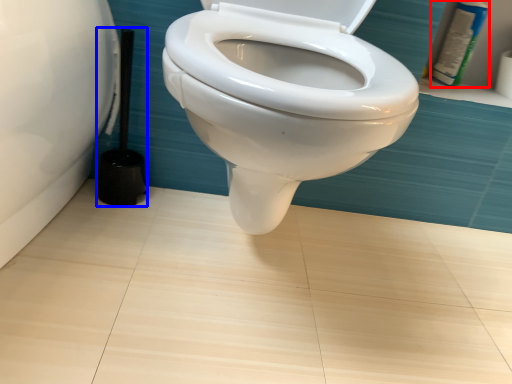
Question: Which object appears closest to the camera in this image, toiletry (highlighted by a red box) or brush (highlighted by a blue box)?

Choices:
 (A) toiletry
 (B) brush

Answer: (B)